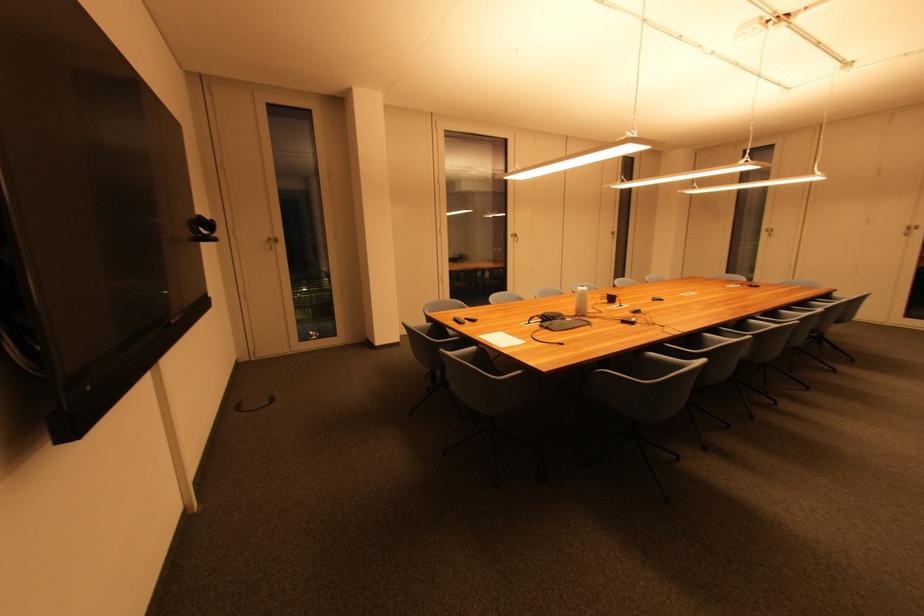
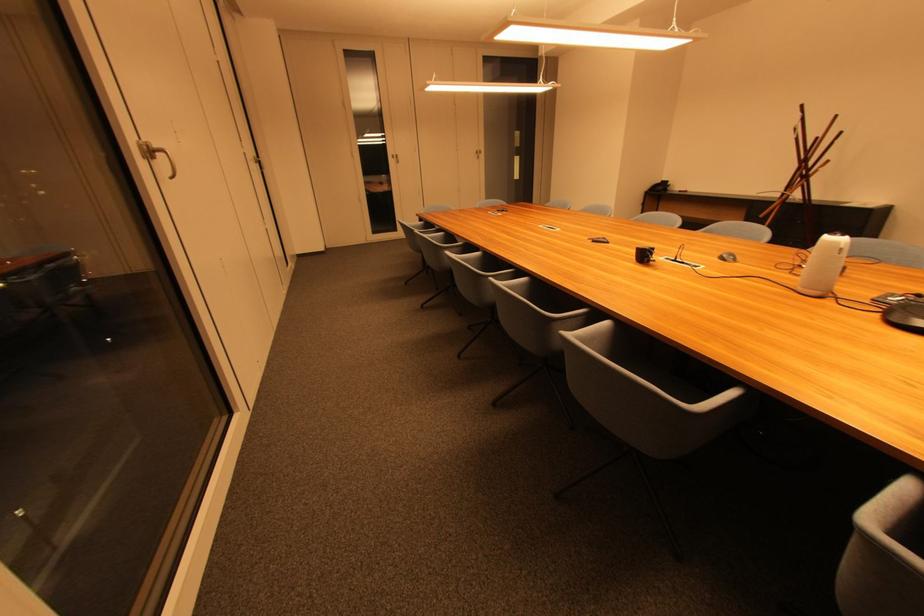
Locate, in the second image, the point that corresponds to point 517,238 in the first image.

(148, 159)